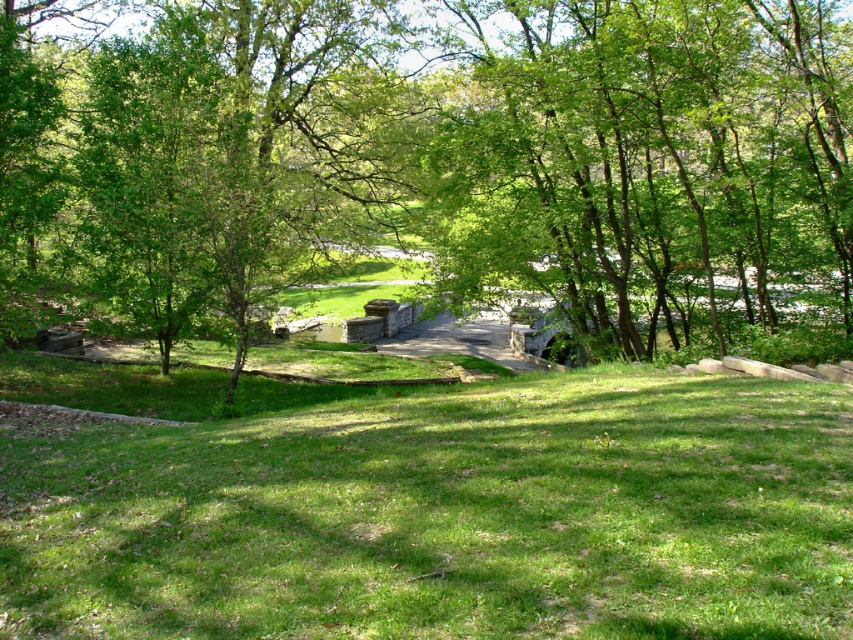
You are a gardener who wants to install a new sprinkler system in the park. The sprinkler needs to reach the tallest object in the area to ensure proper watering. Which object between the green leafy tree at center and the green grassy at center should the sprinkler be aimed at?

The green leafy tree at center is taller than the green grassy at center, so the sprinkler should be aimed at the green leafy tree at center to ensure it reaches the tallest object.

You are planning to set up a picnic blanket in the park. You want to ensure there is enough space between the green leafy tree at center and the green grassy at center for your blanket. Can you determine if there is sufficient space based on their sizes?

The green leafy tree at center is bigger than green grassy at center, but the exact distance between them isn generated in the provided information. Therefore, it is impossible to determine if there is enough space for the picnic blanket based solely on their sizes.

You are planning to place a picnic blanket in the park. The picnic blanket is 2 meters wide. You want to place it between the green leafy tree at center and the green grassy at center. Is there enough space between them to accommodate the picnic blanket?

The distance between the green leafy tree at center and the green grassy at center is 10.13 meters, which is more than enough to place a 2 meter wide picnic blanket between them.